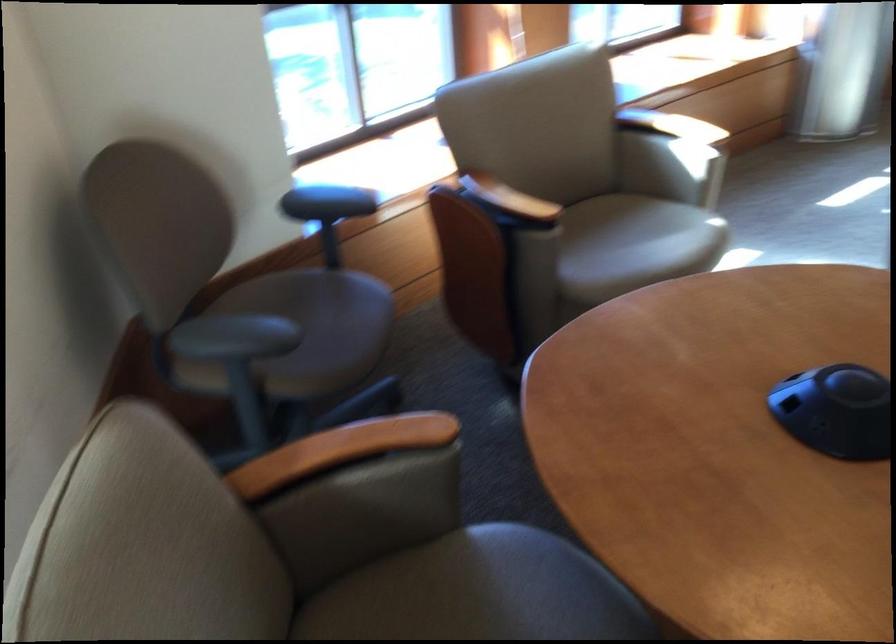
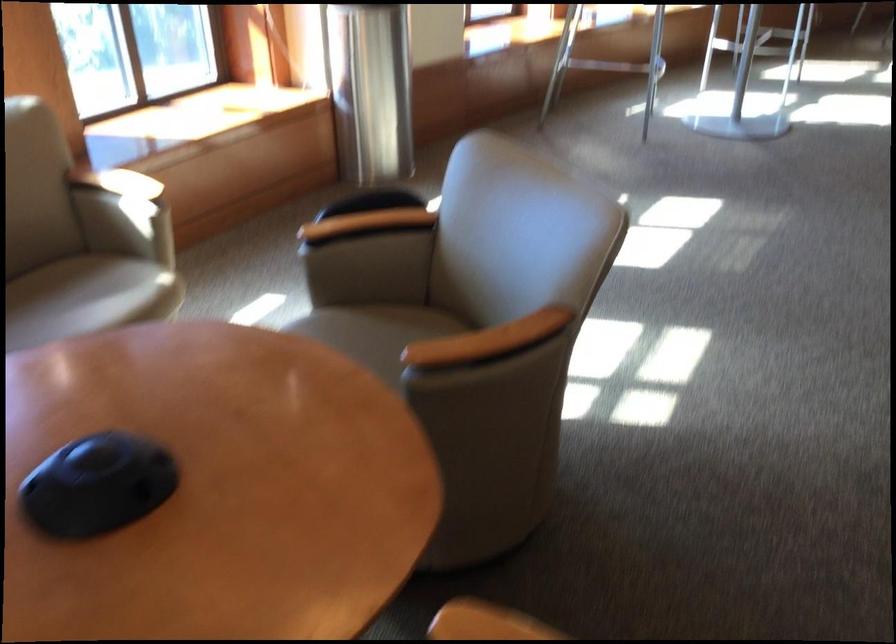
Question: In a continuous first-person perspective shot, in which direction is the camera moving?

Choices:
 (A) Left
 (B) Right
 (C) Forward
 (D) Backward

Answer: (B)